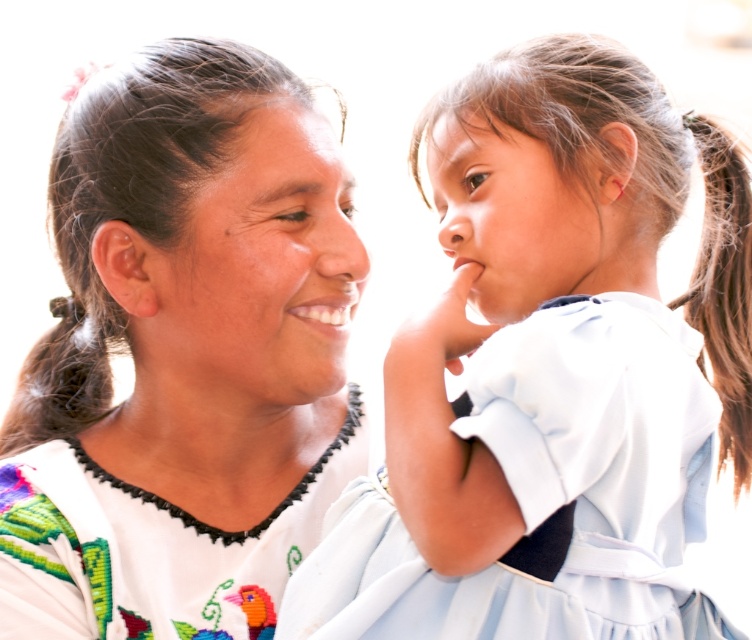
Question: Does white embroidered blouse at center appear on the right side of light blue fabric dress at upper right?

Choices:
 (A) no
 (B) yes

Answer: (A)

Question: Which of the following is the farthest from the observer?

Choices:
 (A) (165, 515)
 (B) (566, 388)

Answer: (A)

Question: Considering the real-world distances, which object is closest to the light blue fabric dress at upper right?

Choices:
 (A) white embroidered dress at center
 (B) white embroidered blouse at center
 (C) light blue fabric dress at center

Answer: (C)

Question: Can you confirm if light blue fabric dress at upper right is positioned to the right of white embroidered dress at center?

Choices:
 (A) yes
 (B) no

Answer: (A)

Question: Does light blue fabric dress at center have a smaller size compared to light blue fabric dress at upper right?

Choices:
 (A) no
 (B) yes

Answer: (B)

Question: Among these objects, which one is farthest from the camera?

Choices:
 (A) white embroidered dress at center
 (B) white embroidered blouse at center

Answer: (B)